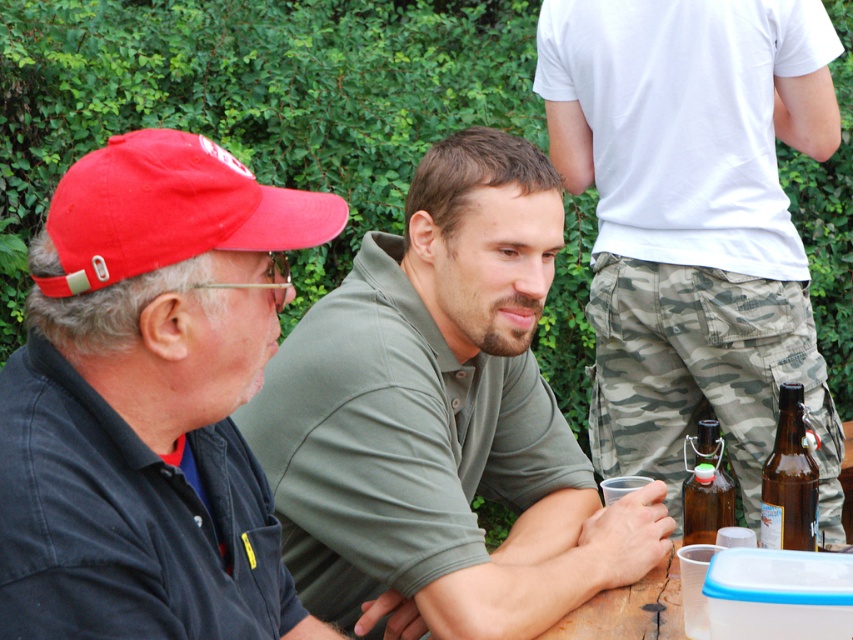
Can you confirm if green cotton shirt at center is taller than red fabric baseball cap at left?

Indeed, green cotton shirt at center has a greater height compared to red fabric baseball cap at left.

Is green cotton shirt at center bigger than red fabric baseball cap at left?

Yes, green cotton shirt at center is bigger than red fabric baseball cap at left.

Is point (355, 492) positioned in front of point (148, 216)?

No, (355, 492) is further to viewer.

I want to click on green cotton shirt at center, so click(x=442, y=417).

Which of these two, green cotton shirt at center or brown glass bottle at center, stands shorter?

With less height is brown glass bottle at center.

Measure the distance between green cotton shirt at center and brown glass bottle at center.

They are 15.87 inches apart.

Locate an element on the screen. The width and height of the screenshot is (853, 640). green cotton shirt at center is located at coordinates (442, 417).

At what (x,y) coordinates should I click in order to perform the action: click on green cotton shirt at center. Please return your answer as a coordinate pair (x, y). Looking at the image, I should click on (442, 417).

Does matte black shirt at left appear under red fabric baseball cap at left?

Yes.

Looking at this image, how much distance is there between matte black shirt at left and red fabric baseball cap at left?

They are 5.64 inches apart.

Does point (173, 234) come closer to viewer compared to point (73, 288)?

That is False.

I want to click on matte black shirt at left, so click(x=148, y=397).